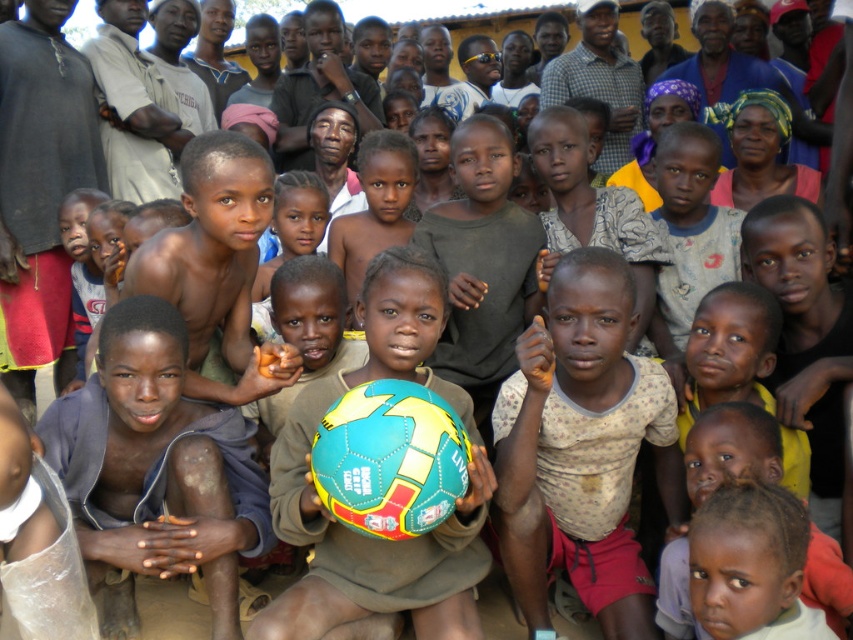
You are a photographer trying to capture a photo of the brown skin boy at center and the multicolored rubber ball at center. Based on their heights, which one should you focus on first if you want to ensure both are in the frame?

The brown skin boy at center has a lesser height compared to the multicolored rubber ball at center, so you should focus on the brown skin boy at center first to ensure both are in the frame.